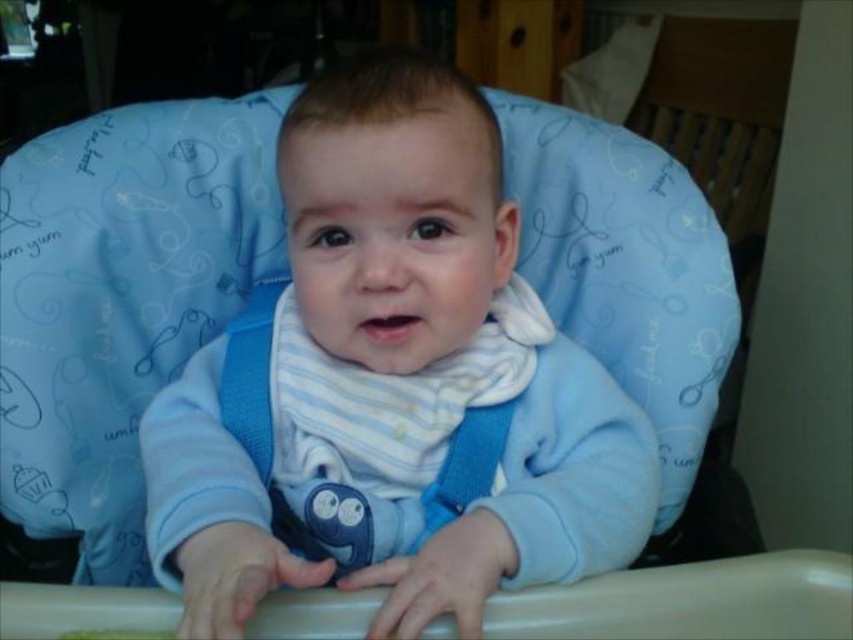
Question: Which of the following is the farthest from the observer?

Choices:
 (A) (280, 484)
 (B) (614, 540)

Answer: (A)

Question: Can you confirm if blue soft bib at center is thinner than white striped bib at center?

Choices:
 (A) yes
 (B) no

Answer: (B)

Question: Is blue soft bib at center bigger than white striped bib at center?

Choices:
 (A) yes
 (B) no

Answer: (A)

Question: Is blue soft bib at center to the left of white striped bib at center from the viewer's perspective?

Choices:
 (A) no
 (B) yes

Answer: (B)